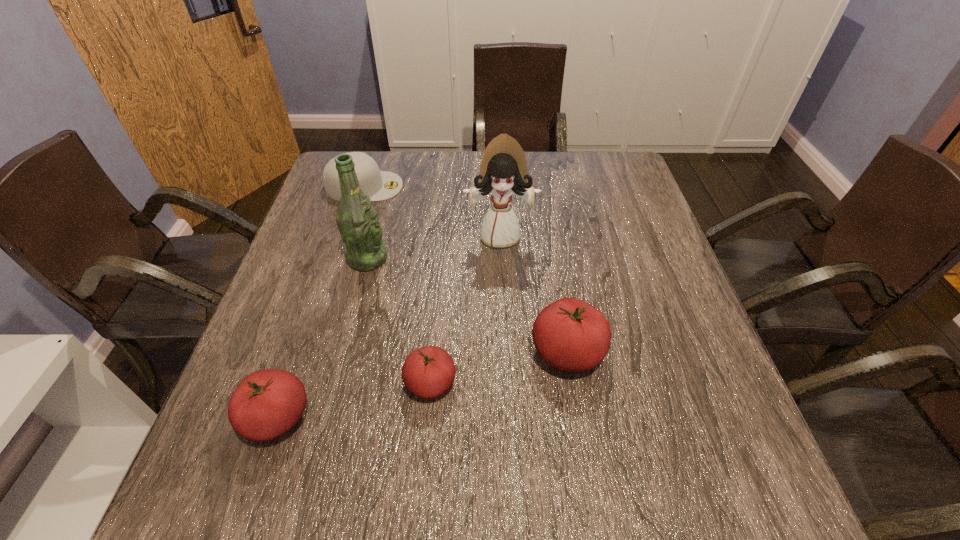
Locate an element on the screen. The height and width of the screenshot is (540, 960). free space between the fourth shortest object and the beer bottle is located at coordinates (468, 306).

Identify the location of vacant area that lies between the doll and the cap. This screenshot has width=960, height=540. (432, 211).

Where is `empty location between the farthest object and the third shortest object`? empty location between the farthest object and the third shortest object is located at coordinates coord(321,302).

Locate an element on the screen. free space that is in between the rightmost tomato and the beer bottle is located at coordinates (468, 306).

Locate an element on the screen. The image size is (960, 540). free space between the tallest tomato and the shortest tomato is located at coordinates (499, 368).

In order to click on blank region between the third tallest object and the second tomato from left to right in this screenshot , I will do `click(499, 368)`.

Locate an element on the screen. the second closest object relative to the third shortest object is located at coordinates (358, 222).

Select which object appears as the closest to the beer bottle. Please provide its 2D coordinates. Your answer should be formatted as a tuple, i.e. [(x, y)], where the tuple contains the x and y coordinates of a point satisfying the conditions above.

[(379, 185)]

In order to click on tomato that is the second closest one to the tallest tomato in this screenshot , I will do `click(267, 403)`.

Where is `tomato that is the third closest to the beer bottle`? This screenshot has height=540, width=960. tomato that is the third closest to the beer bottle is located at coordinates (569, 334).